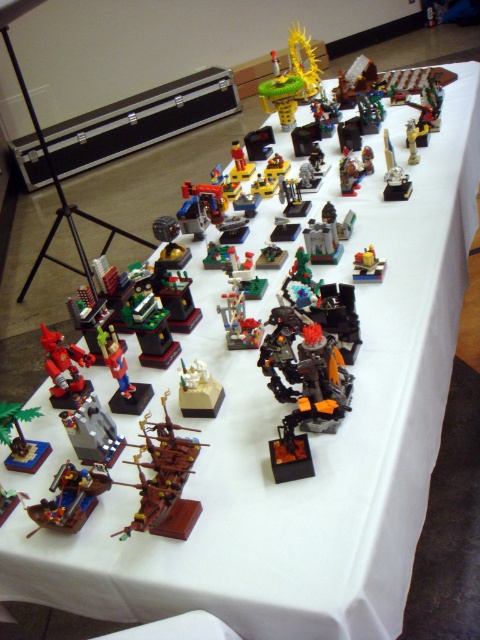
You are a LEGO collector who wants to place a new LEGO brick on the table. You have a new brick that is 2 cm tall. You see the yellow metallic dragon at upper center and the translucent yellow brick at center. Which object is taller than your new brick?

The yellow metallic dragon at upper center is much taller than the translucent yellow brick at center. Since your new brick is 2 cm tall, the yellow metallic dragon at upper center is taller than your new brick.

You are organizing a LEGO exhibition and need to place a new small model between the brown wooden ship at center and the metallic silver tower at center. Considering their sizes, which existing model should the new model be placed closer to?

The new small model should be placed closer to the metallic silver tower at center because the brown wooden ship at center is larger in size, so the smaller tower allows for a better proportional fit.

You are organizing a display and need to ensure there is enough space between the brick red wooden ship at lower left and the white matte statue at center for a 12 inch wide decorative mat. Can you place the mat between them?

The brick red wooden ship at lower left is only 10.99 inches from the white matte statue at center, which is less than the 12 inch width of the decorative mat. Therefore, the mat cannot be placed between them.